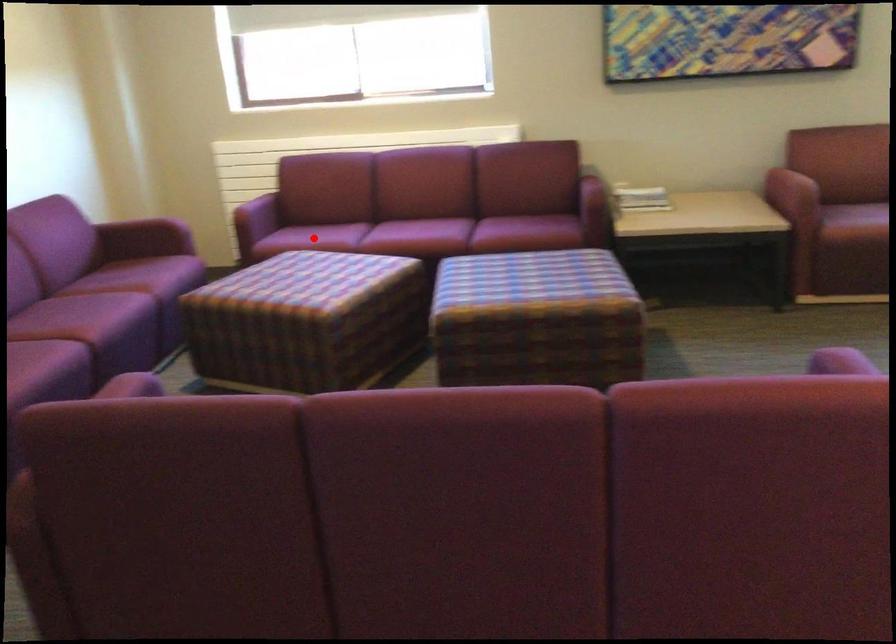
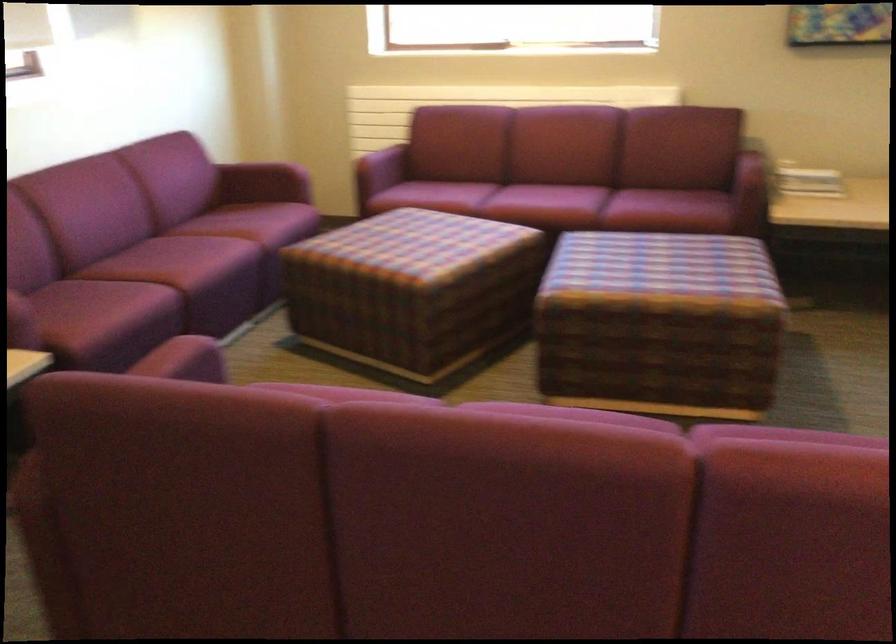
Where in the second image is the point corresponding to the highlighted location from the first image?

(432, 196)